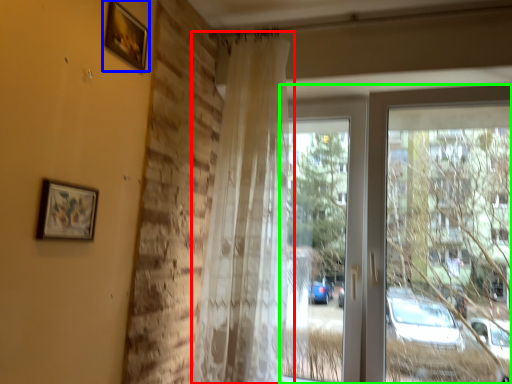
Question: Considering the real-world distances, which object is farthest from curtain (highlighted by a red box)? picture frame (highlighted by a blue box) or window (highlighted by a green box)?

Choices:
 (A) picture frame
 (B) window

Answer: (A)